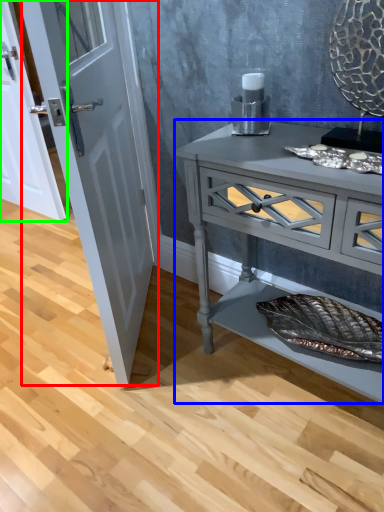
Question: Which object is the closest to the door (highlighted by a red box)? Choose among these: chest of drawers (highlighted by a blue box) or door (highlighted by a green box).

Choices:
 (A) chest of drawers
 (B) door

Answer: (A)